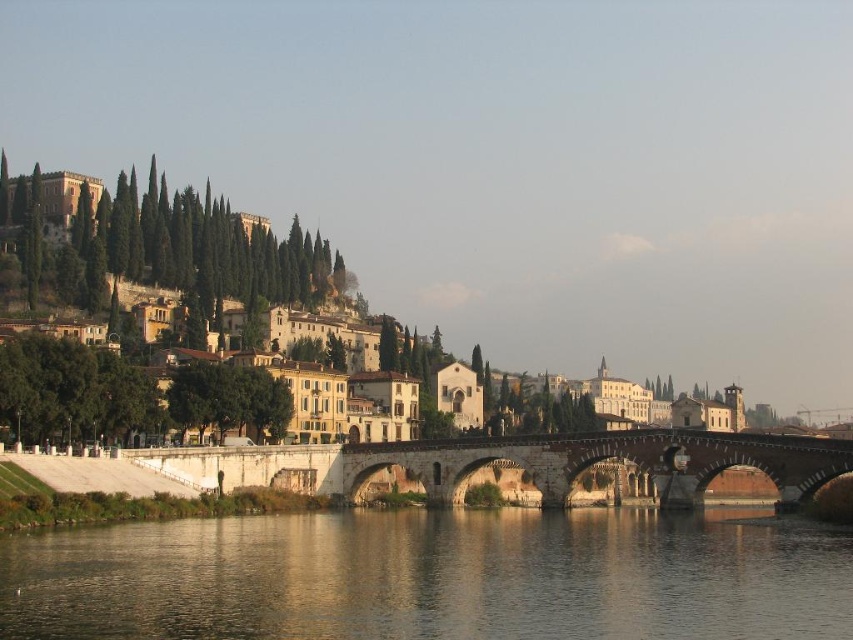
You are a tourist standing on the riverside pathway. You want to take a photo that includes both the yellow stone buildings at center and the stone bridge at center. Which object should you position closer to the camera to ensure both are fully visible in the frame?

Since the yellow stone buildings at center are larger than the stone bridge at center, you should position the stone bridge at center closer to the camera to ensure both fit within the frame.

You are a tourist standing on the stone bridge at center and want to take a photo of the transparent water at center. In which direction should you point your camera?

You should point your camera to the left of the stone bridge at center to capture the transparent water at center, as the transparent water at center is located to the left of the stone bridge at center.

You are standing at the point marked as point (431, 577) in the riverside scene. What do you see directly below you?

The point (431, 577) corresponds to transparent water at center, so you would see transparent water directly below you.